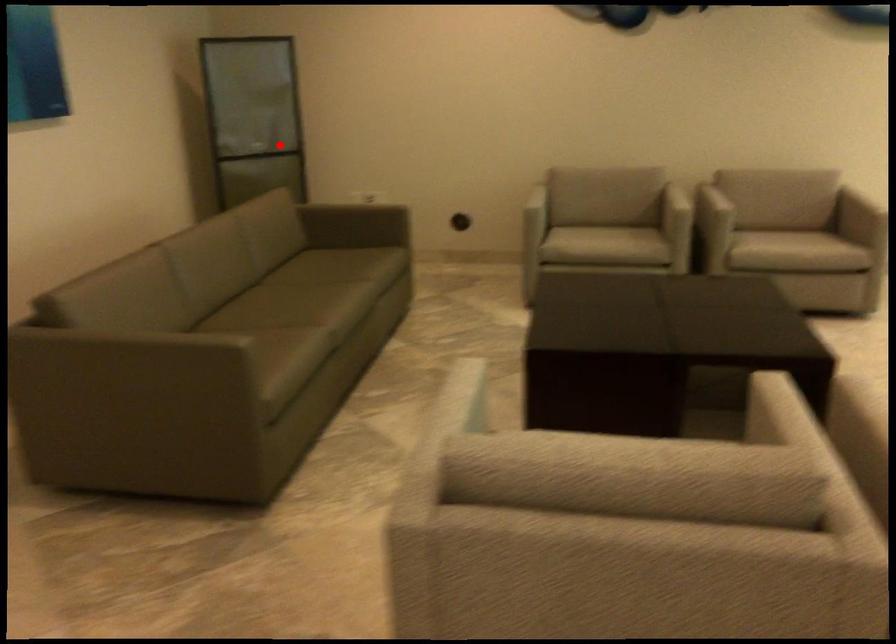
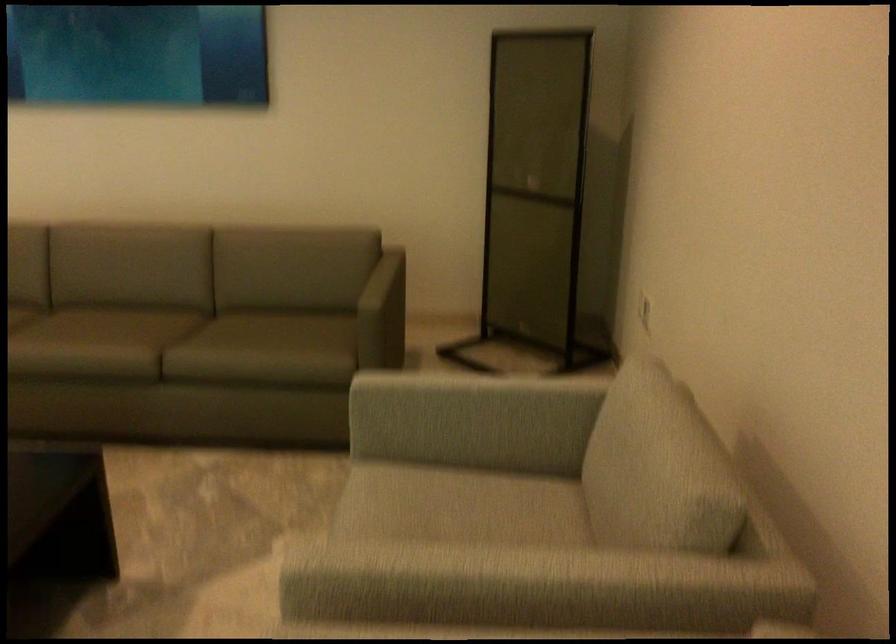
Find the pixel in the second image that matches the highlighted location in the first image.

(536, 194)